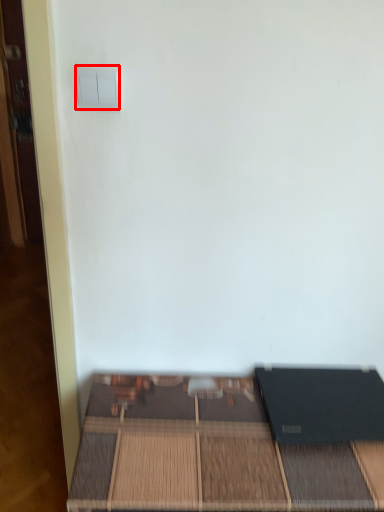
Question: From the image's perspective, where is light switch (annotated by the red box) located in relation to furniture in the image?

Choices:
 (A) below
 (B) above

Answer: (B)